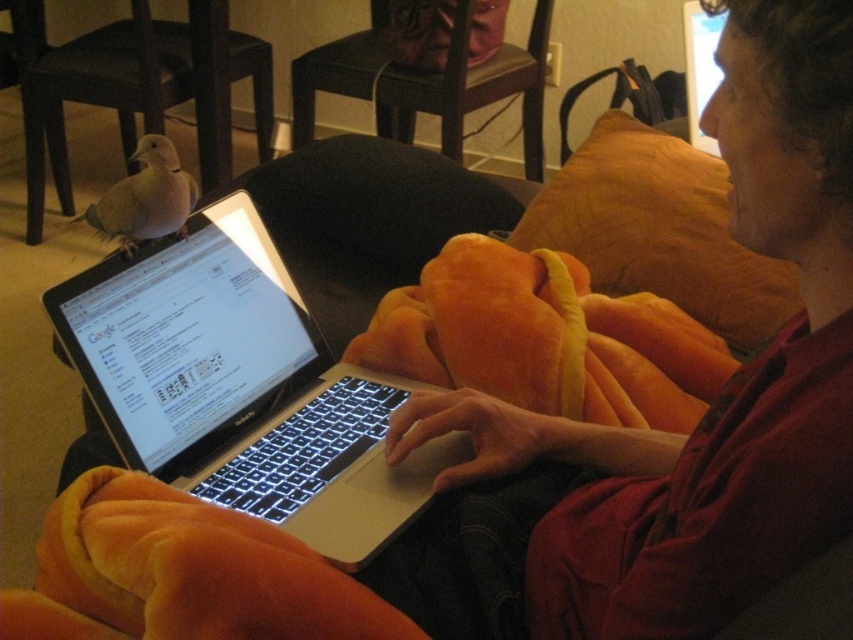
You are taking a photo of the scene and want to focus on the point at coordinates point (631, 228) and point (25, 150). Which point should you focus on first to ensure the closest object is in sharp focus?

Point (631, 228) is closer to the camera than point (25, 150), so you should focus on point (631, 228) first to ensure the closest object is in sharp focus.

You are trying to find a comfortable spot to place your new book on the couch. You see an orange plush pillow at upper right and a matte orange blanket at lower left. Which object is located beneath the other?

The orange plush pillow at upper right is positioned under the matte orange blanket at lower left.

You are organizing a space for a study session and need to place a new desk between the silver metallic laptop at center and the dark wood chair at upper center. Considering their sizes, which object should be placed closer to the wall to save space?

The silver metallic laptop at center has a smaller size compared to the dark wood chair at upper center, so placing the dark wood chair at upper center closer to the wall would save more space as it takes up more space.